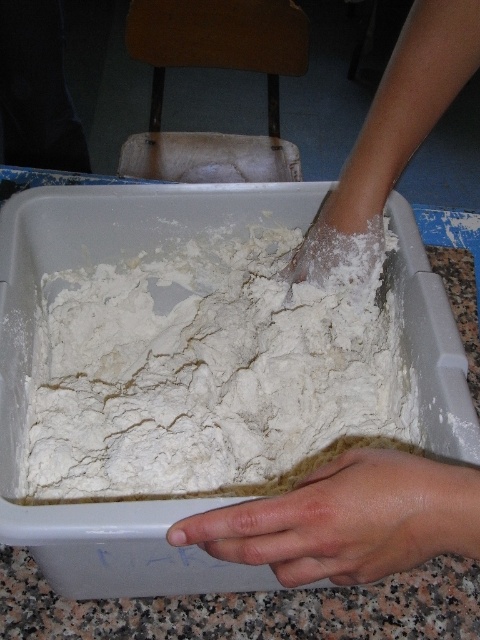
From the picture: Between white powdery flour at center and dry skin at lower center, which one appears on the right side from the viewer's perspective?

dry skin at lower center

Who is lower down, white powdery flour at center or dry skin at lower center?

Positioned lower is dry skin at lower center.

Between point (43, 326) and point (420, 532), which one is positioned in front?

Point (420, 532) is in front.

Find the location of a particular element. white powdery flour at center is located at coordinates (211, 372).